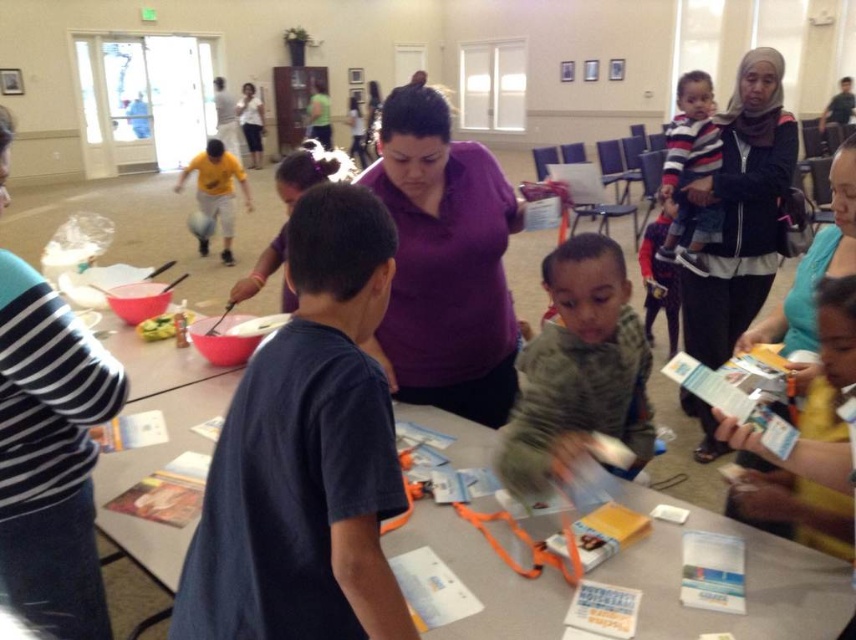
From the picture: Does black matte jacket at upper right have a greater width compared to yellow cotton shirt at upper left?

No.

Consider the image. Which is above, black matte jacket at upper right or yellow cotton shirt at upper left?

yellow cotton shirt at upper left is higher up.

Who is more distant from viewer, [779,65] or [242,193]?

The point [242,193] is behind.

You are a GUI agent. You are given a task and a screenshot of the screen. Output one action in this format:
    pyautogui.click(x=<x>, y=<y>)
    Task: Click on the black matte jacket at upper right
    
    Given the screenshot: What is the action you would take?
    pyautogui.click(x=740, y=211)

Looking at this image, can you confirm if white paper table at center is positioned to the left of gray knit sweater at center?

Correct, you'll find white paper table at center to the left of gray knit sweater at center.

Does white paper table at center appear under gray knit sweater at center?

Correct, white paper table at center is located below gray knit sweater at center.

What do you see at coordinates (746, 561) in the screenshot?
I see `white paper table at center` at bounding box center [746, 561].

Locate an element on the screen. The width and height of the screenshot is (856, 640). white paper table at center is located at coordinates (746, 561).

Between white paper table at center and black matte jacket at upper right, which one appears on the left side from the viewer's perspective?

white paper table at center

Between white paper table at center and black matte jacket at upper right, which one is positioned higher?

black matte jacket at upper right is above.

I want to click on white paper table at center, so click(x=746, y=561).

The height and width of the screenshot is (640, 856). I want to click on white paper table at center, so click(x=746, y=561).